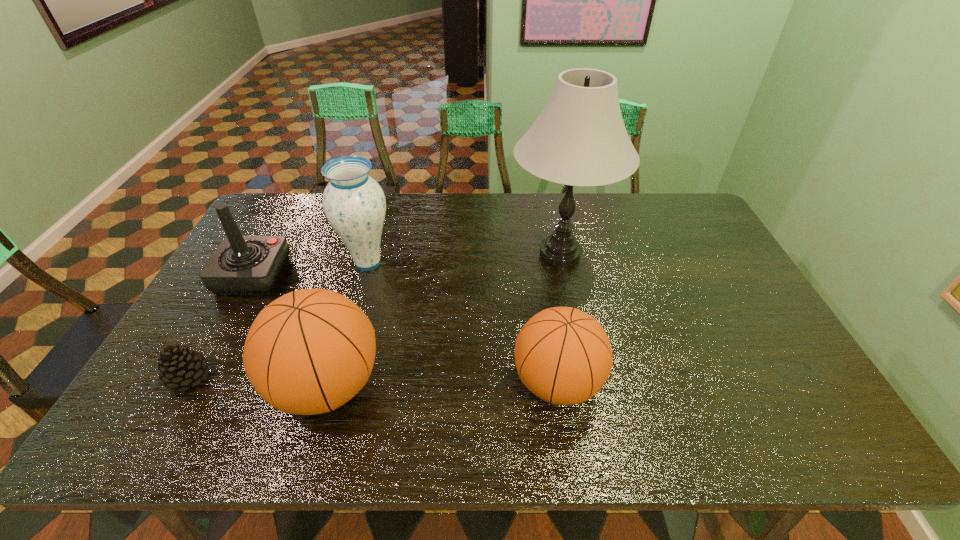
Locate an element on the screen. Image resolution: width=960 pixels, height=540 pixels. the taller basketball is located at coordinates (308, 352).

Locate an element on the screen. the shorter basketball is located at coordinates (563, 355).

Identify the location of the second shortest object. (563, 355).

Image resolution: width=960 pixels, height=540 pixels. Identify the location of vase. (354, 204).

Find the location of a particular element. This screenshot has height=540, width=960. joystick is located at coordinates (241, 265).

I want to click on the tallest object, so click(x=579, y=139).

Where is `pinecone`? pinecone is located at coordinates (179, 366).

Identify the location of vacant space located on the right of the taller basketball. (445, 386).

Image resolution: width=960 pixels, height=540 pixels. I want to click on free point located on the left of the second shortest object, so click(x=393, y=383).

Locate an element on the screen. The width and height of the screenshot is (960, 540). vacant space located on the front of the vase is located at coordinates (348, 333).